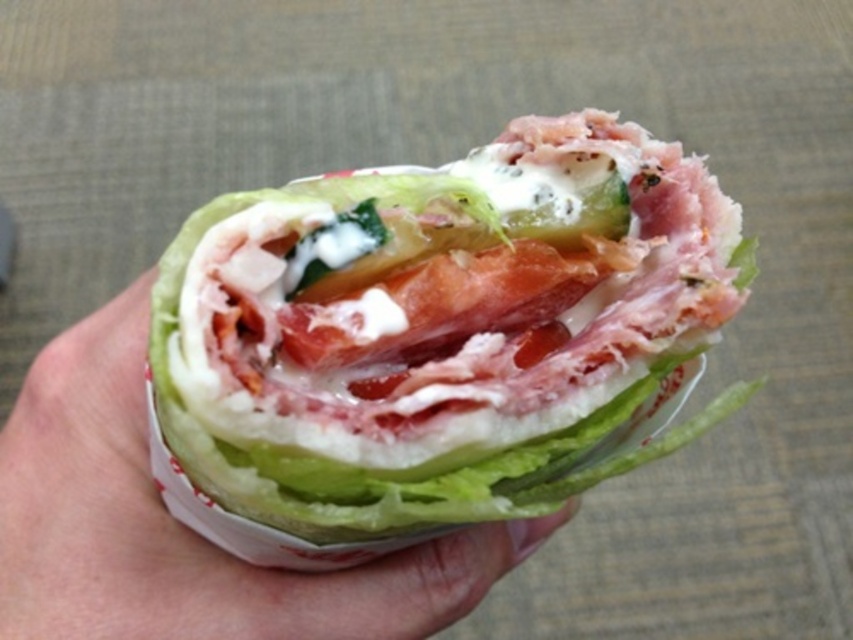
You are a food critic examining the sandwich. You notice a specific point at coordinates [440,326]. What is located at that point?

At point [440,326] lies shiny white wrap at center.

You are a food delivery person who needs to place the shiny white wrap at center and the white paper at center into a delivery box. The box has a height limit of 6 inches. Can both items be placed vertically without exceeding the box height?

The distance between the shiny white wrap at center and the white paper at center is 5.65 inches, which is under the 6 inch height limit. Therefore, both items can be placed vertically in the box without exceeding the height limit.